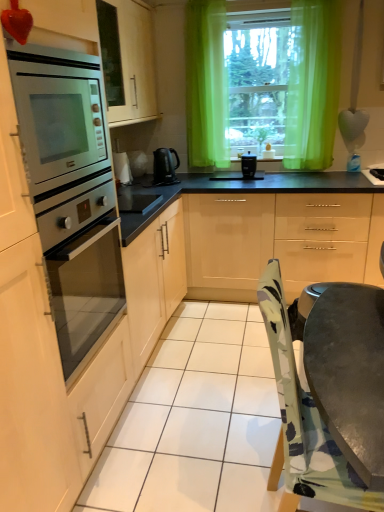
What are the coordinates of `vacant space situated above black glass cooktop at center (from a real-world perspective)` in the screenshot? It's located at (134, 195).